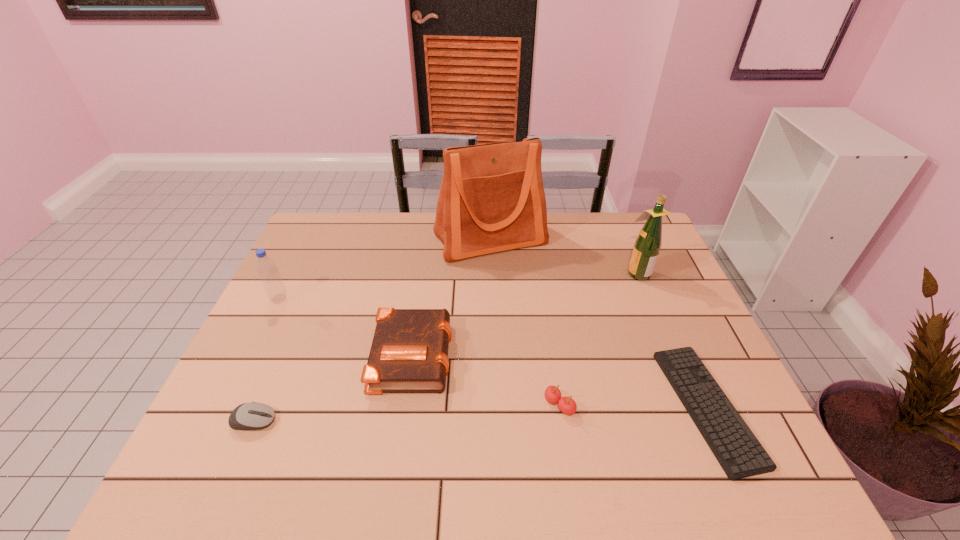
Image resolution: width=960 pixels, height=540 pixels. In the image, there is a desktop. In order to click on free space at the near right corner in this screenshot , I will do `click(712, 484)`.

The width and height of the screenshot is (960, 540). Find the location of `vacant area between the bottle and the shopping bag`. vacant area between the bottle and the shopping bag is located at coordinates (385, 269).

Find the location of a particular element. Image resolution: width=960 pixels, height=540 pixels. free spot between the cherry and the sixth object from right to left is located at coordinates (406, 413).

Where is `free spot between the fifth shortest object and the sixth shortest object`? Image resolution: width=960 pixels, height=540 pixels. free spot between the fifth shortest object and the sixth shortest object is located at coordinates (458, 286).

I want to click on free spot between the bottle and the liquor, so click(458, 286).

The image size is (960, 540). I want to click on vacant point located between the shortest object and the leftmost object, so click(493, 353).

Where is `vacant area that lies between the shopping bag and the second tallest object`? Image resolution: width=960 pixels, height=540 pixels. vacant area that lies between the shopping bag and the second tallest object is located at coordinates (564, 256).

At what (x,y) coordinates should I click in order to perform the action: click on vacant space that's between the Bible and the cherry. Please return your answer as a coordinate pair (x, y). Image resolution: width=960 pixels, height=540 pixels. Looking at the image, I should click on (486, 379).

Where is `free space between the shopping bag and the cherry`? This screenshot has height=540, width=960. free space between the shopping bag and the cherry is located at coordinates (525, 322).

What are the coordinates of `free space between the third farthest object and the tallest object` in the screenshot? It's located at (385, 269).